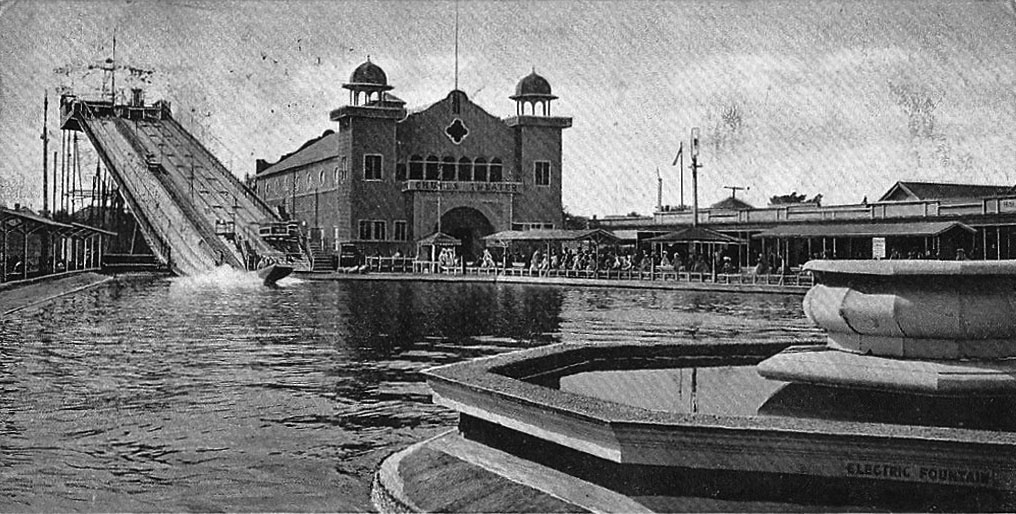
Find the location of a particular element. old photograph is located at coordinates (617, 130).